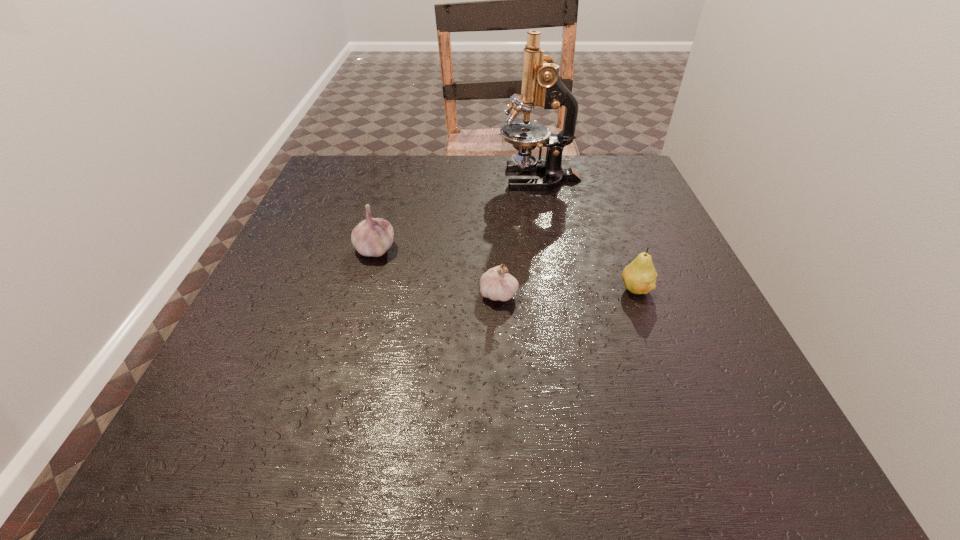
I want to click on free location that satisfies the following two spatial constraints: 1. at the eyepiece of the pear; 2. on the left side of the microscope, so click(561, 289).

At what (x,y) coordinates should I click in order to perform the action: click on vacant area that satisfies the following two spatial constraints: 1. at the eyepiece of the farthest object; 2. on the right side of the pear. Please return your answer as a coordinate pair (x, y). Image resolution: width=960 pixels, height=540 pixels. Looking at the image, I should click on (561, 289).